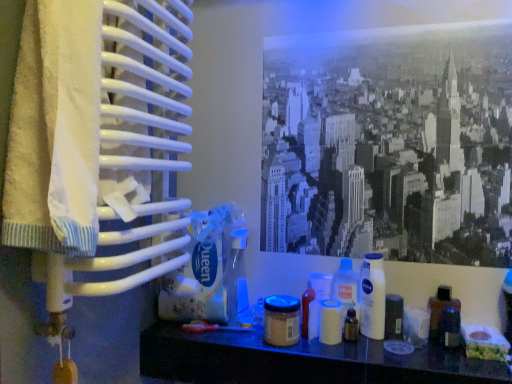
Identify the location of free point in front of white plastic bottle at center-right, which is counted as the second bottle, starting from the right. The image size is (512, 384). (390, 354).